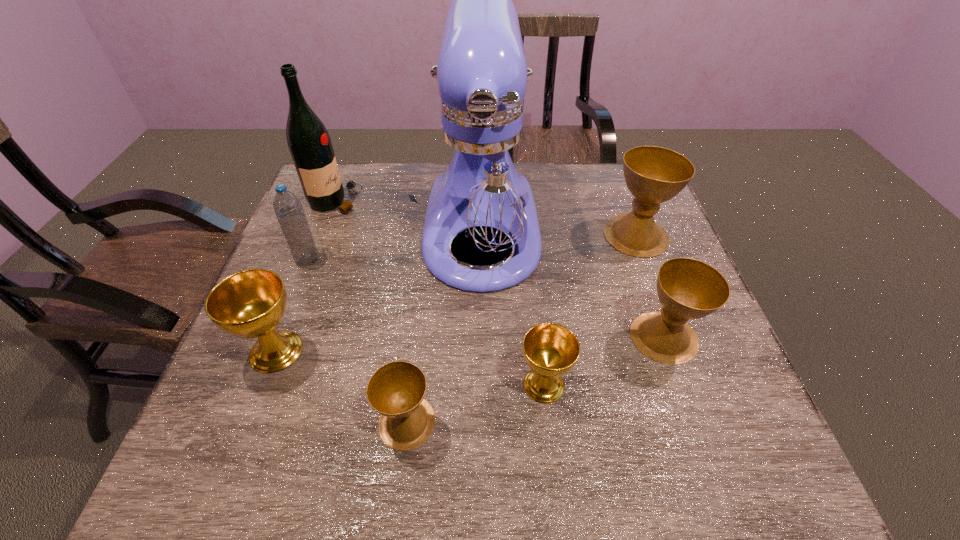
At what (x,y) coordinates should I click in order to perform the action: click on mixer. Please return your answer as a coordinate pair (x, y). Looking at the image, I should click on (481, 183).

You are a GUI agent. You are given a task and a screenshot of the screen. Output one action in this format:
    pyautogui.click(x=<x>, y=<y>)
    Task: Click on the blue mixer
    The width and height of the screenshot is (960, 540).
    Given the screenshot: What is the action you would take?
    click(x=481, y=183)

You are a GUI agent. You are given a task and a screenshot of the screen. Output one action in this format:
    pyautogui.click(x=<x>, y=<y>)
    Task: Click on the green wine bottle
    The width and height of the screenshot is (960, 540).
    Given the screenshot: What is the action you would take?
    pyautogui.click(x=308, y=140)

Where is `the second tallest object`? The image size is (960, 540). the second tallest object is located at coordinates (308, 140).

Find the location of a particular element. Image resolution: width=960 pixels, height=540 pixels. the biggest brown chalice is located at coordinates (653, 175).

Locate an element on the screen. This screenshot has width=960, height=540. the farthest brown chalice is located at coordinates (653, 175).

Locate an element on the screen. water bottle is located at coordinates (288, 209).

Where is `the second biggest brown chalice`? The height and width of the screenshot is (540, 960). the second biggest brown chalice is located at coordinates (688, 289).

Where is `the bigger gold chalice`? the bigger gold chalice is located at coordinates (249, 304).

The image size is (960, 540). Find the location of `the leftmost chalice`. the leftmost chalice is located at coordinates (249, 304).